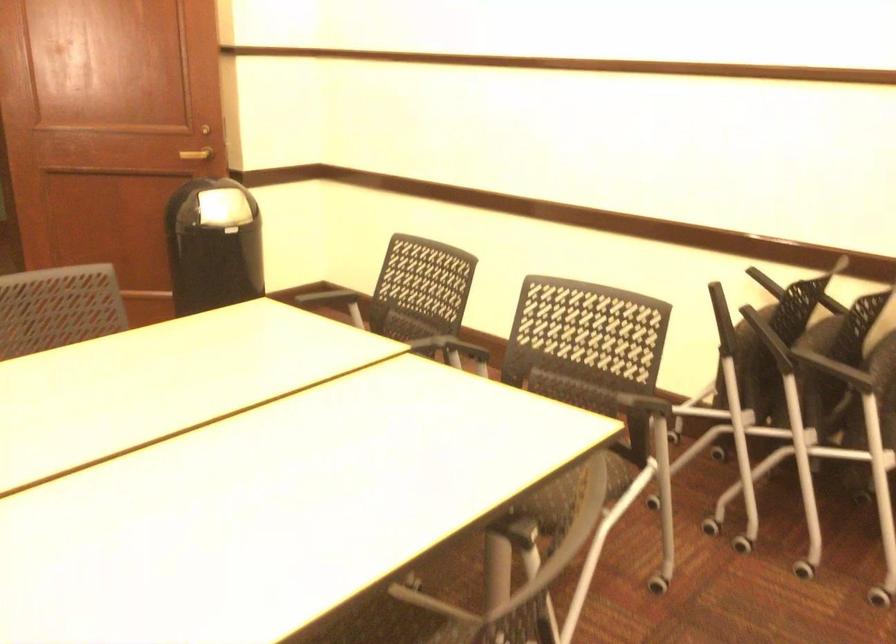
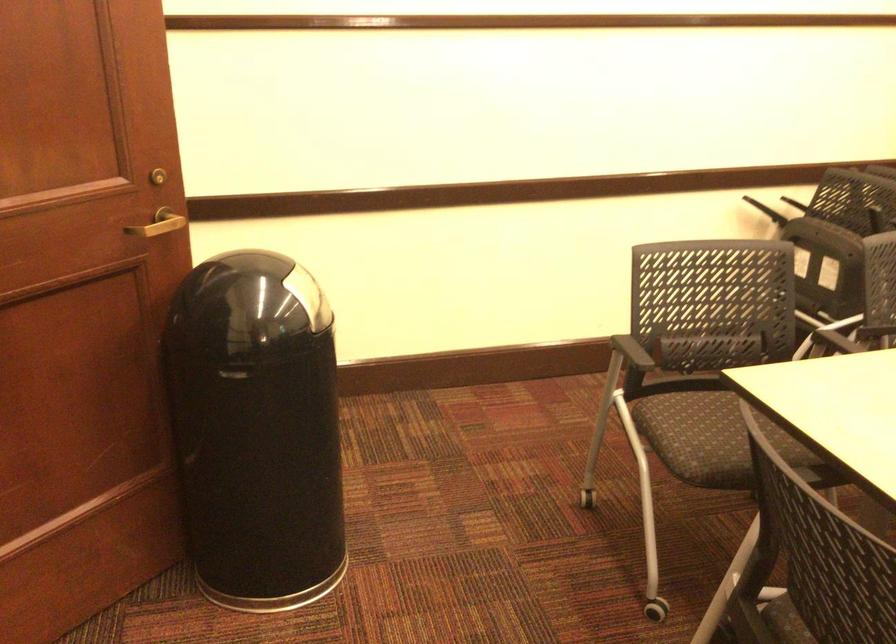
The point at (169,129) is marked in the first image. Where is the corresponding point in the second image?

(158, 223)